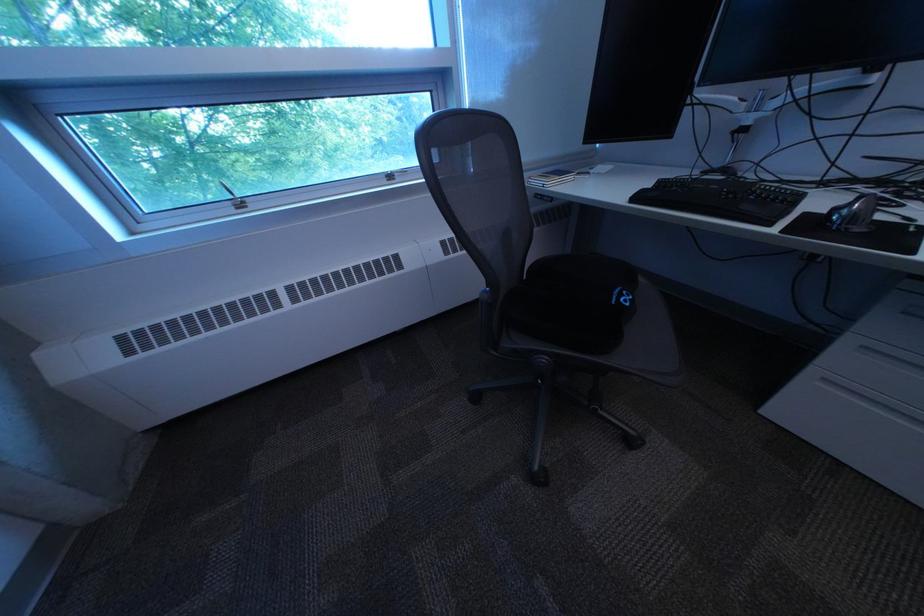
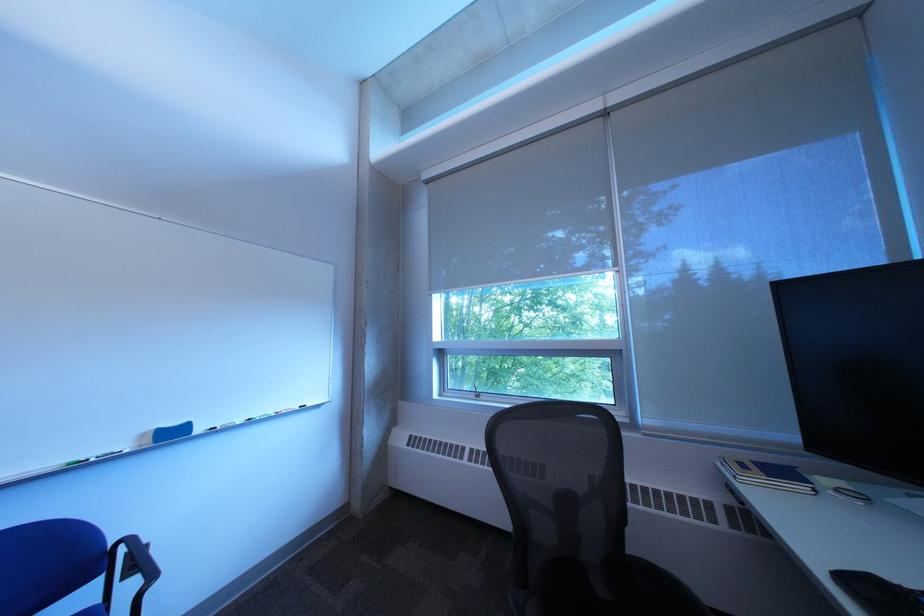
The first image is from the beginning of the video and the second image is from the end. How did the camera likely rotate when shooting the video?

The rotation direction of the camera is left-up.